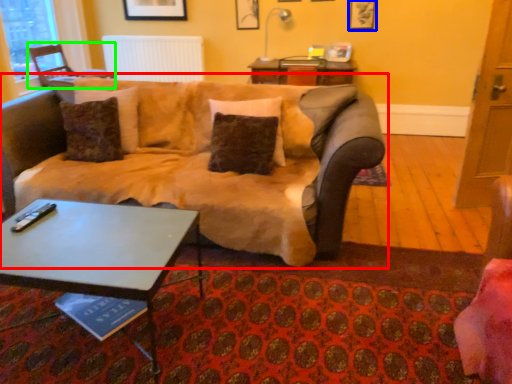
Question: Which is nearer to the studio couch (highlighted by a red box)? picture frame (highlighted by a blue box) or chair (highlighted by a green box).

Choices:
 (A) picture frame
 (B) chair

Answer: (B)